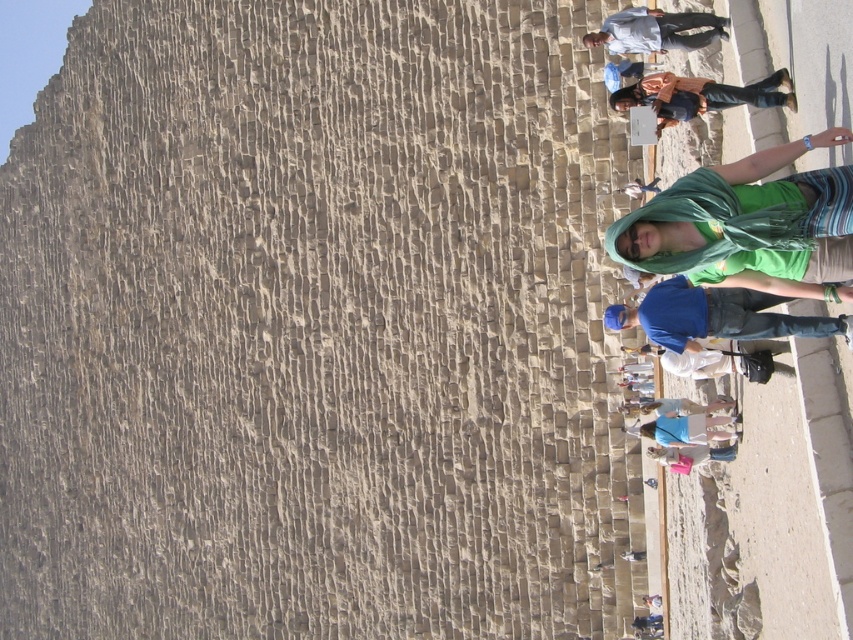
You are standing at the ancient stone structure and see a point at coordinates (700, 96). What object is this point located on?

The point at coordinates (700, 96) is located on the orange fabric hoodie at upper right.

Looking at this image, you are a tour guide at the ancient stone structure. You notice two tourists wearing orange fabric hoodie at upper right and light blue shirt at upper right. Which clothing item is narrower in width?

The orange fabric hoodie at upper right is thinner than light blue shirt at upper right, so the orange fabric hoodie at upper right is narrower in width.

You are a tour guide at the ancient stone structure and notice two tourists wearing orange fabric hoodie at upper right and light blue shirt at upper right. Which tourist takes up more space in the photo?

The light blue shirt at upper right takes up more space in the photo than the orange fabric hoodie at upper right because the orange fabric hoodie at upper right occupies less space than light blue shirt at upper right.